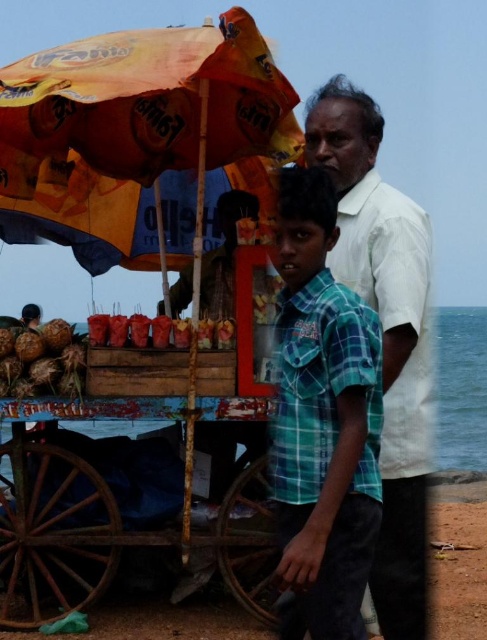
You are a tourist who wants to buy a coconut and a skewer. The vendor is at the food cart. Which item should you ask for first, the brown rough coconuts at lower left or the shiny red skewers at center?

You should ask for the shiny red skewers at center first because the brown rough coconuts at lower left are in front of them, meaning the skewers might be behind and less accessible. The vendor may need to move the coconuts to reach the skewers.

You are a photographer trying to capture the entire orange printed umbrella at upper left and the shiny red skewers at center in one frame. Based on their sizes, which object will require you to step back more to include it fully in the photo?

The orange printed umbrella at upper left requires stepping back more because its width is larger than the shiny red skewers at center.

You are a photographer trying to capture a photo of the green plaid shirt at center and the white cotton shirt at upper center. Which shirt should you focus on first if you want to capture both in the same frame without moving the camera?

The green plaid shirt at center is positioned on the left side of white cotton shirt at upper center, so you should focus on the green plaid shirt at center first to ensure both are in frame.